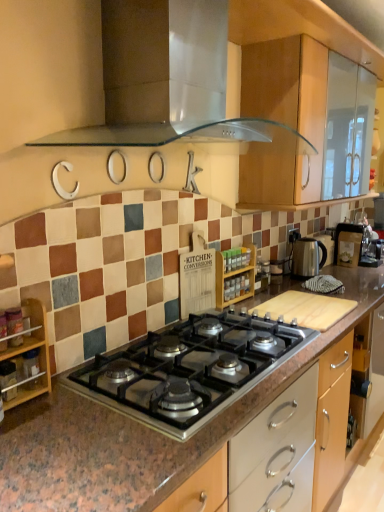
Question: From the image's perspective, would you say wooden spice rack at center, positioned as the 3th appliance in right-to-left order, is shown under transparent glass range hood at upper center?

Choices:
 (A) no
 (B) yes

Answer: (B)

Question: Is transparent glass range hood at upper center at the back of wooden spice rack at center, which is the 1th appliance in left-to-right order?

Choices:
 (A) no
 (B) yes

Answer: (A)

Question: From a real-world perspective, is wooden spice rack at center, which appears as the first appliance when viewed from the front, over transparent glass range hood at upper center?

Choices:
 (A) no
 (B) yes

Answer: (A)

Question: Does wooden spice rack at center, positioned as the 3th appliance in right-to-left order, have a larger size compared to transparent glass range hood at upper center?

Choices:
 (A) yes
 (B) no

Answer: (B)

Question: Is wooden spice rack at center, positioned as the 3th appliance in right-to-left order, not near transparent glass range hood at upper center?

Choices:
 (A) no
 (B) yes

Answer: (A)

Question: Does wooden spice rack at center, which is the 1th appliance in left-to-right order, have a greater height compared to transparent glass range hood at upper center?

Choices:
 (A) no
 (B) yes

Answer: (A)

Question: Is silver metallic kettle at right not inside black stainless steel gas stove at center?

Choices:
 (A) no
 (B) yes

Answer: (B)

Question: From the image's perspective, is silver metallic kettle at right located above black stainless steel gas stove at center?

Choices:
 (A) yes
 (B) no

Answer: (A)

Question: Considering the relative sizes of silver metallic kettle at right and black stainless steel gas stove at center in the image provided, is silver metallic kettle at right thinner than black stainless steel gas stove at center?

Choices:
 (A) yes
 (B) no

Answer: (A)

Question: From the image's perspective, is silver metallic kettle at right under black stainless steel gas stove at center?

Choices:
 (A) no
 (B) yes

Answer: (A)

Question: From a real-world perspective, is silver metallic kettle at right located beneath black stainless steel gas stove at center?

Choices:
 (A) no
 (B) yes

Answer: (A)

Question: Is silver metallic kettle at right closer to camera compared to black stainless steel gas stove at center?

Choices:
 (A) yes
 (B) no

Answer: (B)

Question: Can you confirm if metallic silver kettle at right, marked as the third appliance in a front-to-back arrangement, is positioned to the right of transparent glass range hood at upper center?

Choices:
 (A) no
 (B) yes

Answer: (B)